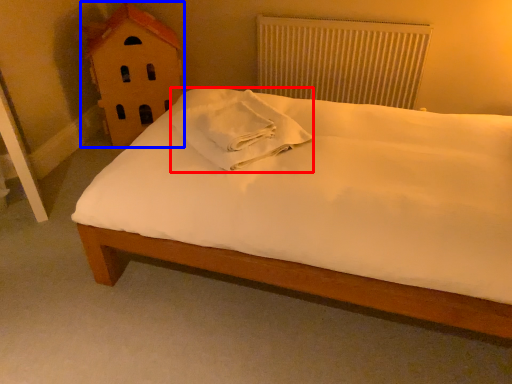
Question: Which object is further to the camera taking this photo, material (highlighted by a red box) or toy (highlighted by a blue box)?

Choices:
 (A) material
 (B) toy

Answer: (B)